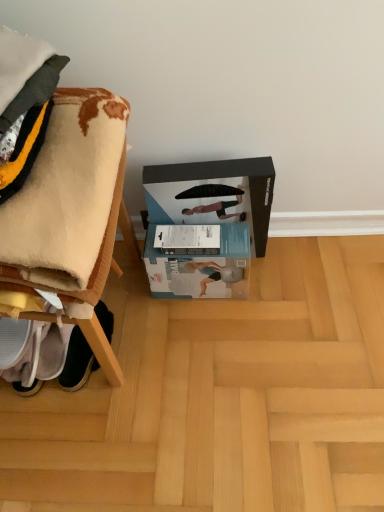
Image resolution: width=384 pixels, height=512 pixels. In order to click on free spot to the right of white fabric shoe at lower left in this screenshot , I will do `click(152, 339)`.